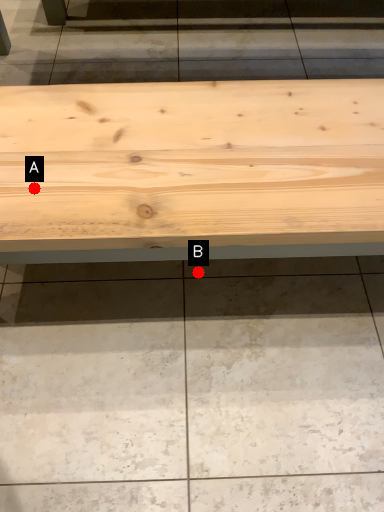
Question: Two points are circled on the image, labeled by A and B beside each circle. Which point is farther to the camera?

Choices:
 (A) A is further
 (B) B is further

Answer: (B)